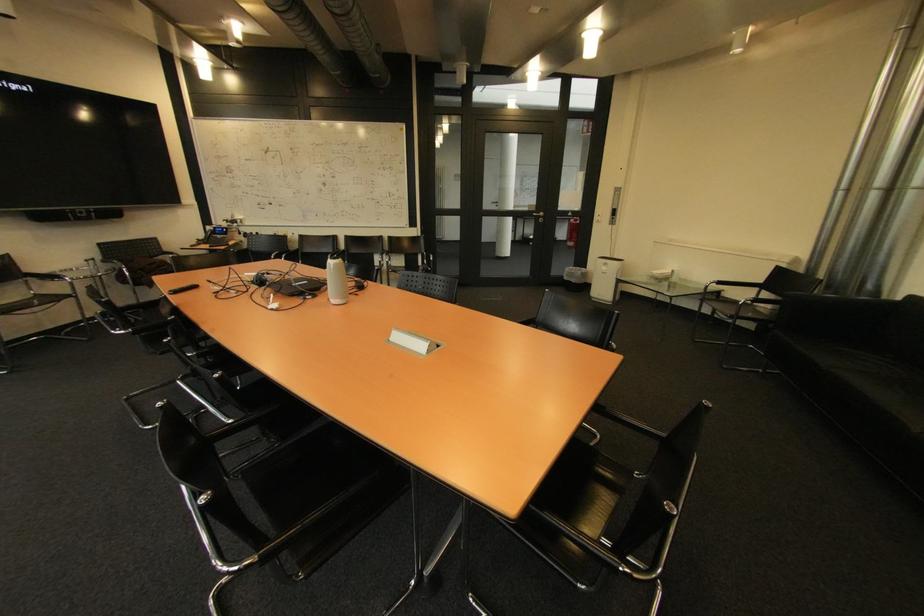
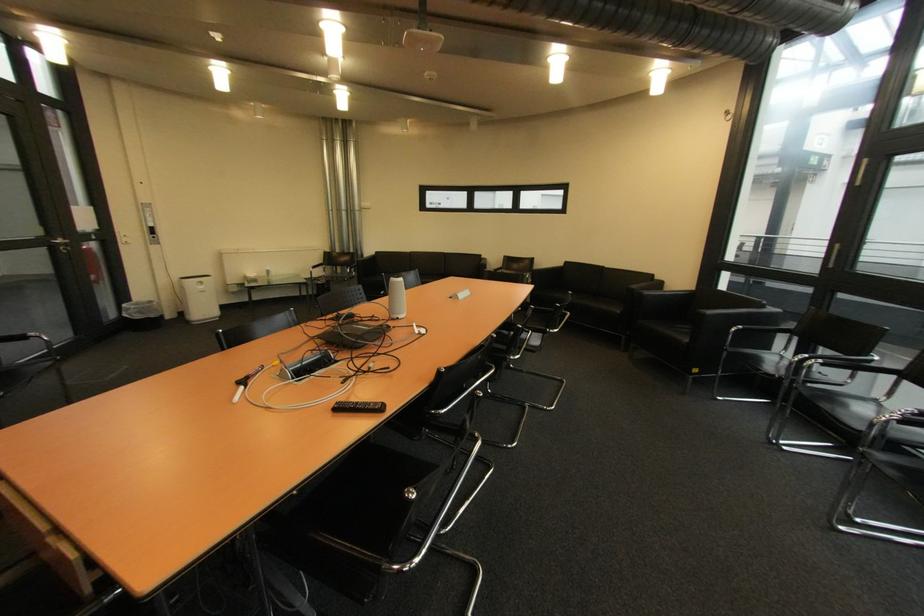
The point at (574, 280) is marked in the first image. Where is the corresponding point in the second image?

(147, 318)